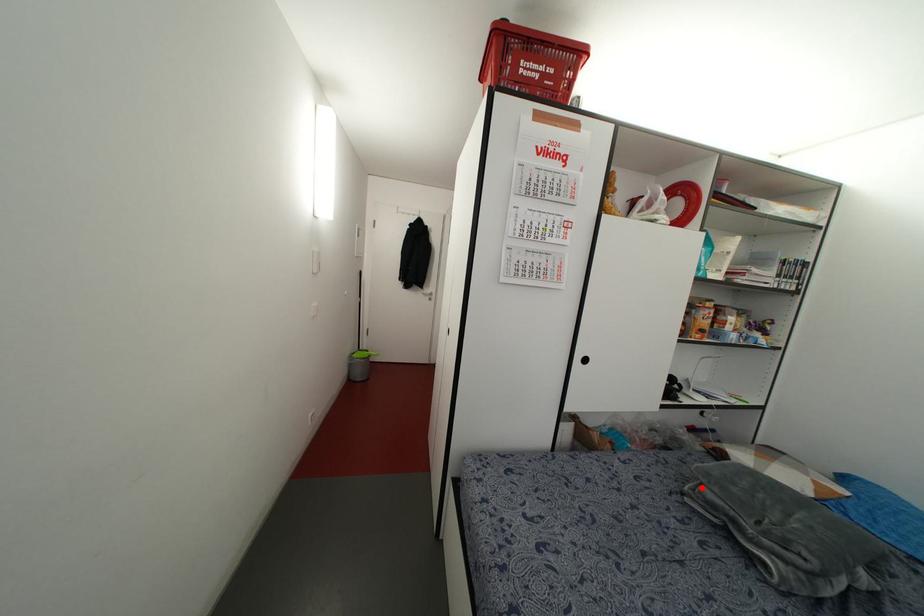
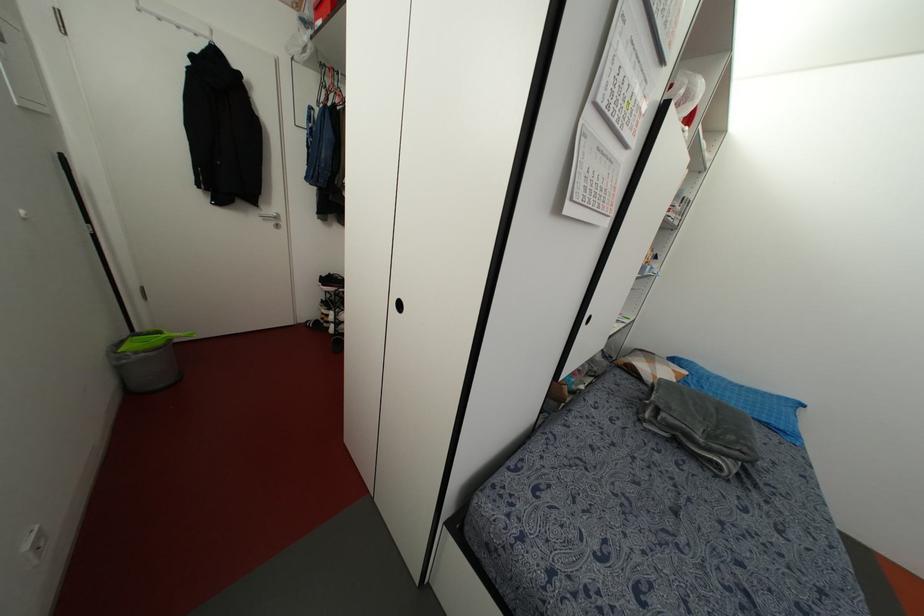
The point at the highlighted location is marked in the first image. Where is the corresponding point in the second image?

(663, 415)